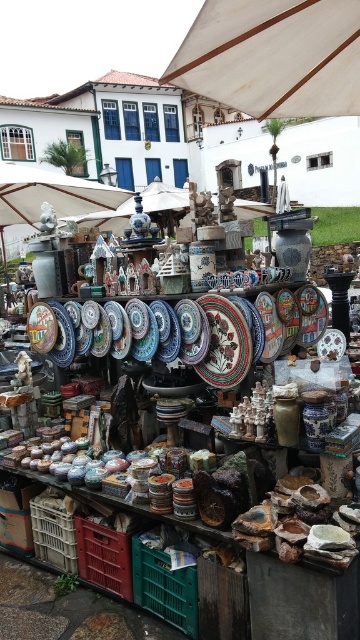
Question: Which is nearer to the plastic crate at lower left?

Choices:
 (A) red plastic crate at lower left
 (B) white canvas umbrella at upper center
 (C) white fabric umbrella at upper center

Answer: (A)

Question: Is white fabric umbrella at upper center below red plastic crate at lower left?

Choices:
 (A) no
 (B) yes

Answer: (A)

Question: Is white fabric umbrella at upper center above red plastic crate at lower left?

Choices:
 (A) yes
 (B) no

Answer: (A)

Question: Which point appears farthest from the camera in this image?

Choices:
 (A) (308, 22)
 (B) (117, 573)

Answer: (B)

Question: Does white canvas umbrella at upper center appear under white fabric umbrella at upper center?

Choices:
 (A) no
 (B) yes

Answer: (B)

Question: Which point appears farthest from the camera in this image?

Choices:
 (A) (316, 19)
 (B) (91, 557)
 (C) (150, 580)

Answer: (B)